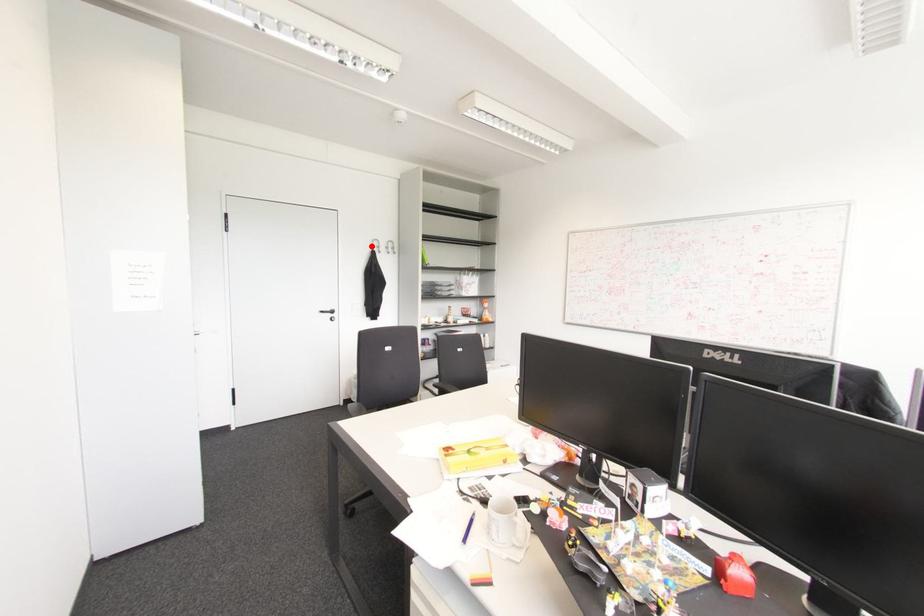
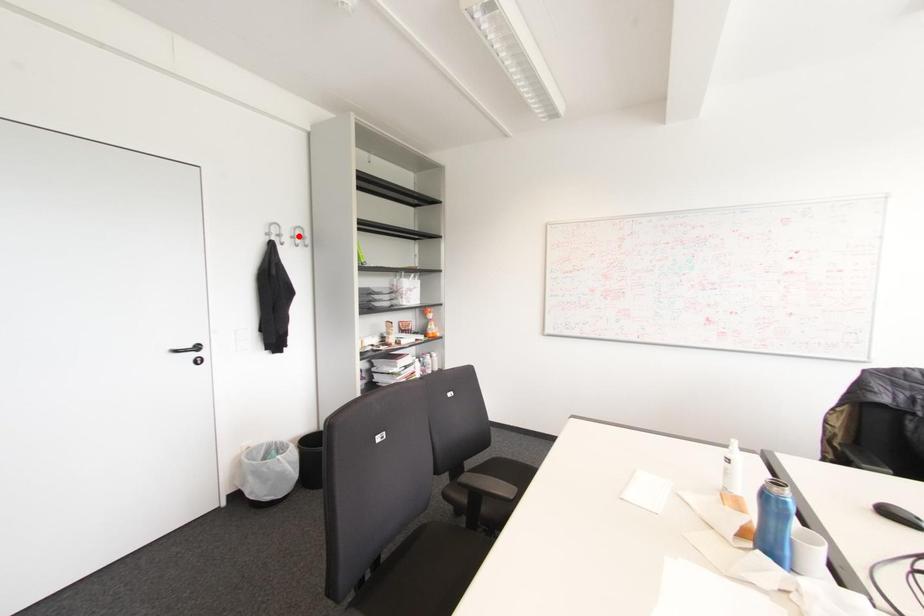
I am providing you with two images of the same scene from different viewpoints. A red point is marked on the first image and another point is marked on the second image. Do the highlighted points in image1 and image2 indicate the same real-world spot?

No